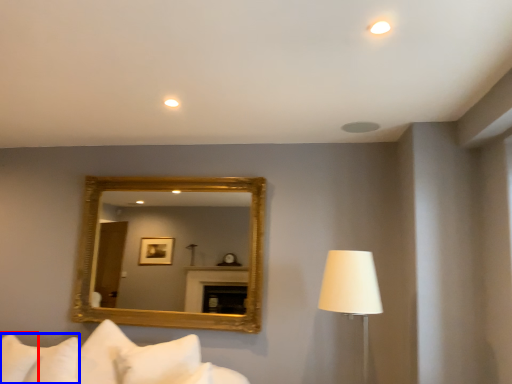
Question: Which object appears closest to the camera in this image, pillow (highlighted by a red box) or pillow (highlighted by a blue box)?

Choices:
 (A) pillow
 (B) pillow

Answer: (B)